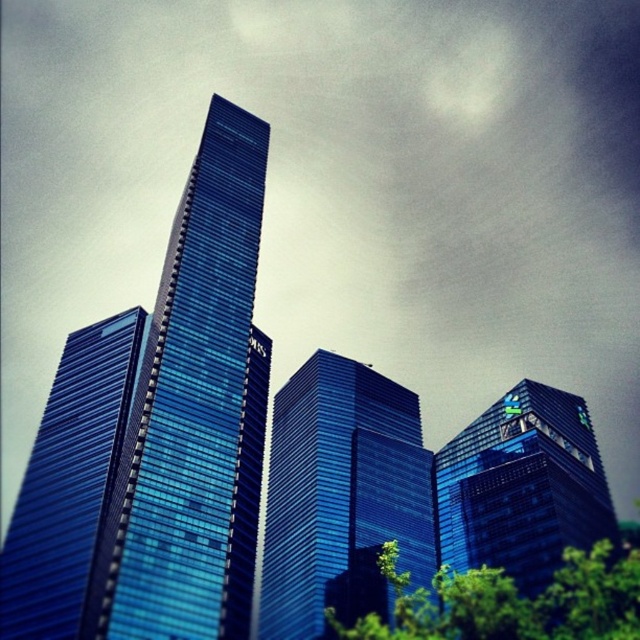
Question: Does blue glass building at center have a smaller size compared to glossy glass building at upper right?

Choices:
 (A) yes
 (B) no

Answer: (B)

Question: Can you confirm if glossy glass skyscraper at left is positioned to the left of green leafy tree at lower center?

Choices:
 (A) yes
 (B) no

Answer: (A)

Question: Which point is closer to the camera?

Choices:
 (A) green leafy tree at lower center
 (B) glossy glass skyscraper at left
 (C) glossy glass building at upper right

Answer: (B)

Question: Does glossy glass building at upper right appear under green leafy tree at lower center?

Choices:
 (A) no
 (B) yes

Answer: (A)

Question: Among these objects, which one is farthest from the camera?

Choices:
 (A) green leafy tree at lower center
 (B) glossy glass skyscraper at left

Answer: (A)

Question: Considering the real-world distances, which object is closest to the glossy glass building at upper right?

Choices:
 (A) green leafy tree at lower center
 (B) blue glass skyscraper at center
 (C) glossy glass skyscraper at left
 (D) blue glass building at center

Answer: (A)